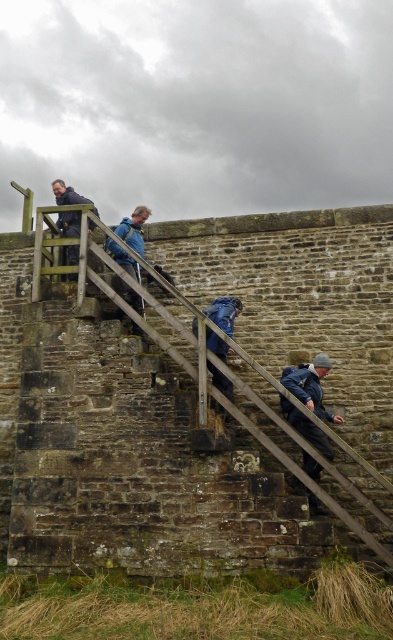
Who is more forward, [211,372] or [55,188]?

Point [211,372] is in front.

Which is below, blue fabric jacket at center or matte black jacket at upper left?

blue fabric jacket at center is below.

Who is more forward, (222,378) or (93,224)?

Positioned in front is point (222,378).

Find the location of a particular element. The width and height of the screenshot is (393, 640). blue fabric jacket at center is located at coordinates (224, 312).

Between point (306, 440) and point (95, 214), which one is positioned in front?

Point (306, 440) is in front.

What are the coordinates of `dark blue jacket at lower right` in the screenshot? It's located at (310, 385).

The width and height of the screenshot is (393, 640). Identify the location of dark blue jacket at lower right. (310, 385).

From the picture: Does wooden at upper left appear over blue fabric jacket at upper center?

Actually, wooden at upper left is below blue fabric jacket at upper center.

Does point (40, 509) come behind point (143, 220)?

No, it is not.

Who is more forward, [49,364] or [113,248]?

Point [49,364] is more forward.

Locate an element on the screen. The height and width of the screenshot is (640, 393). wooden at upper left is located at coordinates (141, 465).